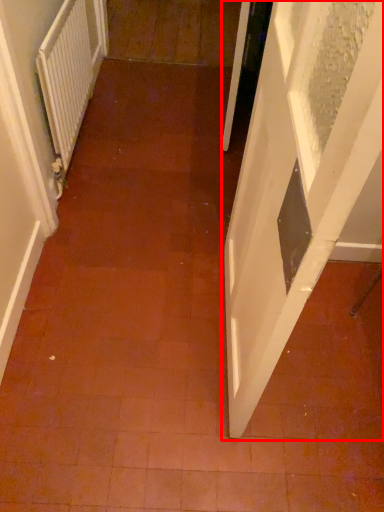
Question: From the image's perspective, considering the relative positions of door (annotated by the red box) and radiator in the image provided, where is door (annotated by the red box) located with respect to the staircase?

Choices:
 (A) above
 (B) below

Answer: (B)